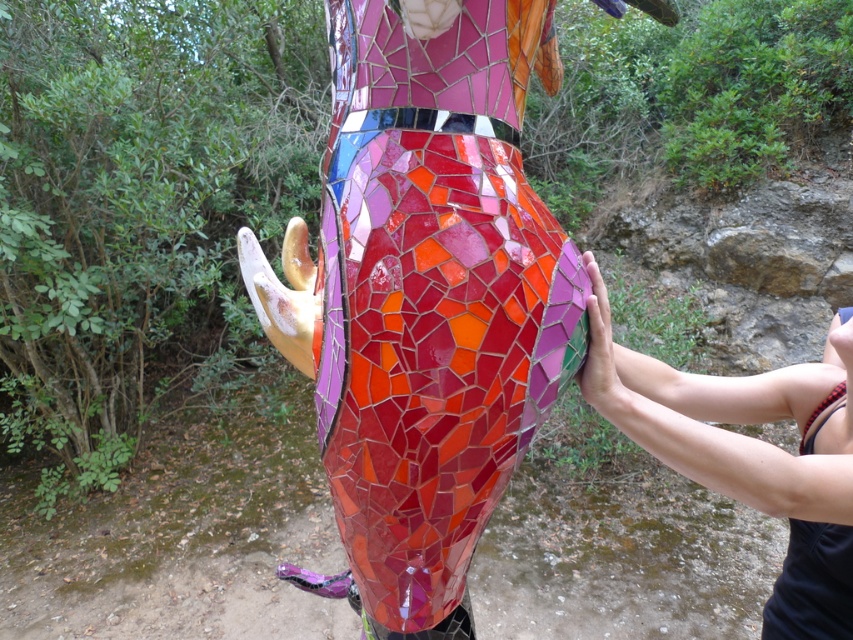
You are standing in front of the mosaic artwork and want to place a small decorative item on the base of the pink mosaic ball at right. However, you need to ensure that the item won not block the view of the mosaic glass sculpture at center. Can you do this?

The mosaic glass sculpture at center is above the pink mosaic ball at right, so placing the item on the base of the pink mosaic ball at right would not block the view of the sculpture since it is positioned lower.

You are an art student standing in front of the mosaic glass sculpture at center and the pink mosaic ball at right. You want to take a photo of both objects in the same frame. Which direction should you move to ensure both are visible?

You should move to the left of the mosaic glass sculpture at center so that both the mosaic glass sculpture at center and the pink mosaic ball at right are visible in the frame.

You are standing in front of the vibrant mosaic sculpture of a bull. There is a point at coordinates (426, 292). What is located at that point?

At point (426, 292) lies the mosaic glass sculpture at center.